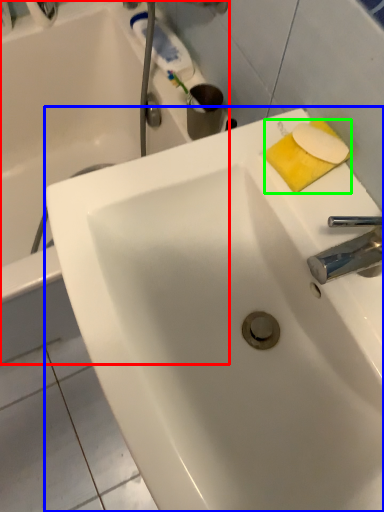
Question: Which object is the farthest from bathtub (highlighted by a red box)? Choose among these: sink (highlighted by a blue box) or soap (highlighted by a green box).

Choices:
 (A) sink
 (B) soap

Answer: (B)